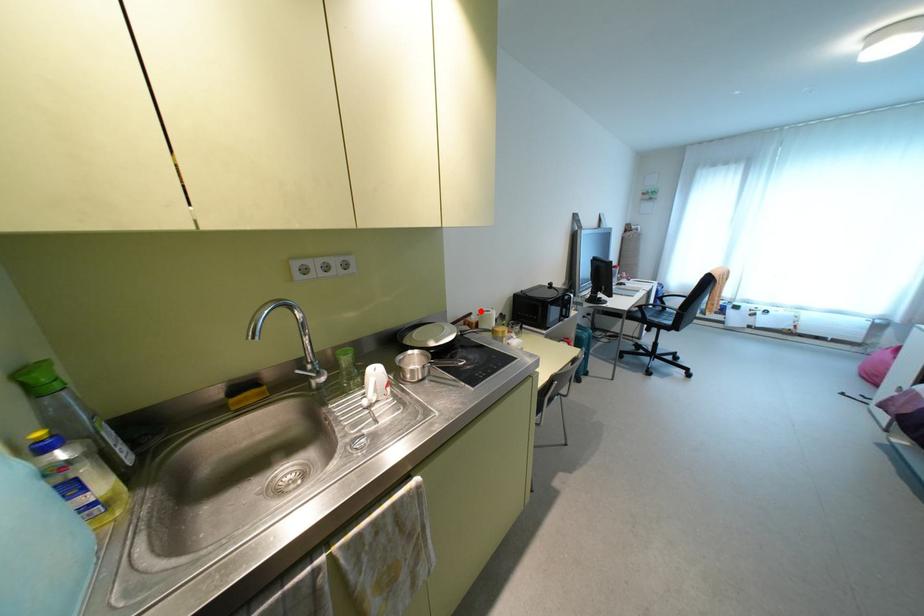
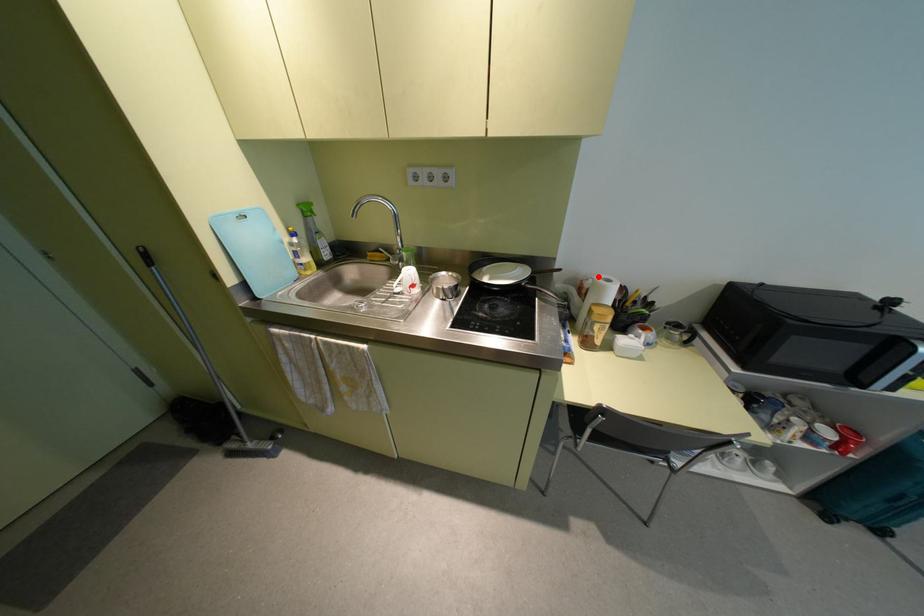
I am providing you with two images of the same scene from different viewpoints. A red point is marked on the first image and another point is marked on the second image. Are the points marked in image1 and image2 representing the same 3D position?

Yes